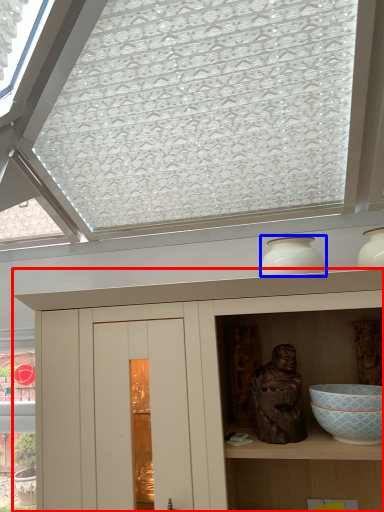
Question: Which of the following is the closest to the observer, cupboard (highlighted by a red box) or vase (highlighted by a blue box)?

Choices:
 (A) cupboard
 (B) vase

Answer: (A)